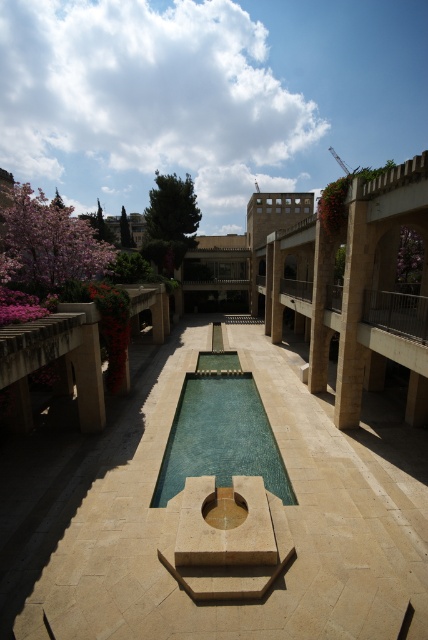
You are standing in the courtyard and want to take a photo of both the point at coordinates (x=237, y=378) and the point at coordinates (x=357, y=285). Which point should you focus on first to ensure both are in focus?

You should focus on the point at coordinates (x=237, y=378) first because it is closer to you than the point at coordinates (x=357, y=285). This way, both points will be in focus as the closer point determines the focal plane.

You are an architect designing a new courtyard and want to ensure proper spacing between the brown stone pillar at center and the beige stone pillar at center. Which pillar has a greater width that requires more space?

The brown stone pillar at center has a greater width than the beige stone pillar at center, so it requires more space.